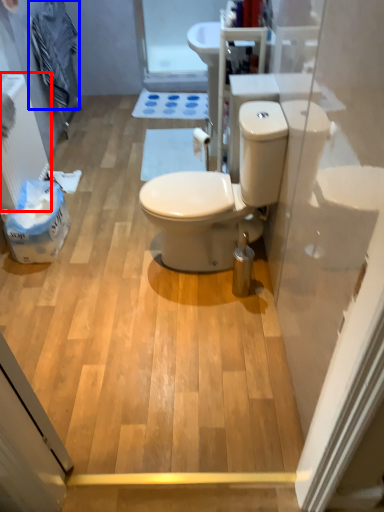
Question: Among these objects, which one is nearest to the camera, radiator (highlighted by a red box) or laundry (highlighted by a blue box)?

Choices:
 (A) radiator
 (B) laundry

Answer: (A)